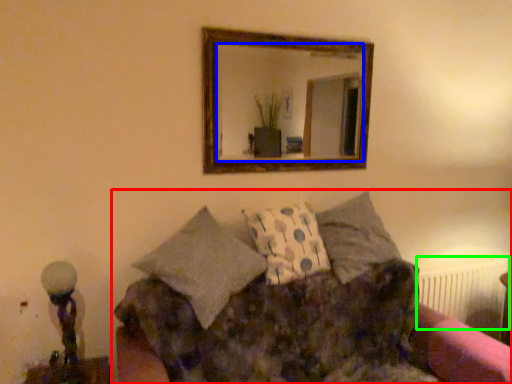
Question: Which object is positioned closest to studio couch (highlighted by a red box)? Select from mirror (highlighted by a blue box) and radiator (highlighted by a green box).

Choices:
 (A) mirror
 (B) radiator

Answer: (B)